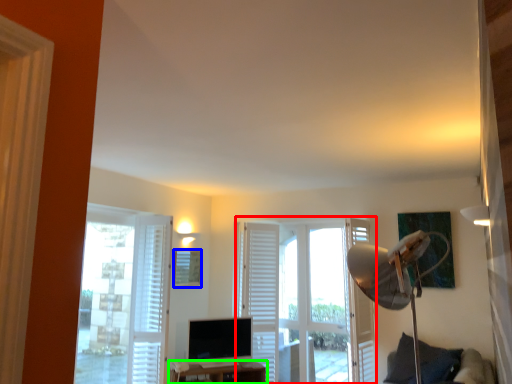
Question: Considering the real-world distances, which object is closest to door (highlighted by a red box)? picture frame (highlighted by a blue box) or furniture (highlighted by a green box).

Choices:
 (A) picture frame
 (B) furniture

Answer: (B)